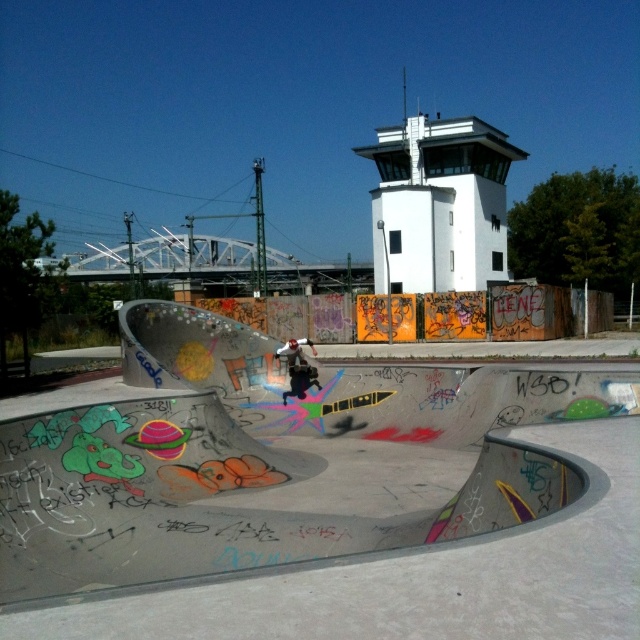
You are a photographer trying to capture the skateboarder in the center of the skatepark bowl. You notice two points marked on the bowl wall. The first point is at coordinates point [172,580] and the second point is at point [304,392]. Which point is closer to your camera lens?

Point [172,580] is closer to the camera than point [304,392].

You are a drone operator trying to capture the skateboarder in the blue glossy skateboard at center. The white smooth control tower at upper center is in the way. Can you fly the drone above the control tower to get a clear shot of the skateboarder?

The white smooth control tower at upper center is taller than the blue glossy skateboard at center, so yes, you can fly the drone above the white smooth control tower at upper center to get a clear shot of the skateboarder on the blue glossy skateboard at center.